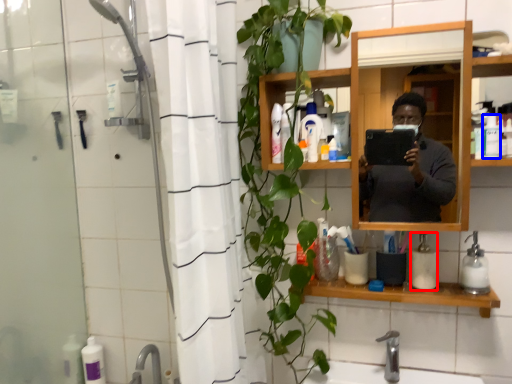
Question: Which object appears farthest to the camera in this image, soap dispenser (highlighted by a red box) or toiletry (highlighted by a blue box)?

Choices:
 (A) soap dispenser
 (B) toiletry

Answer: (A)